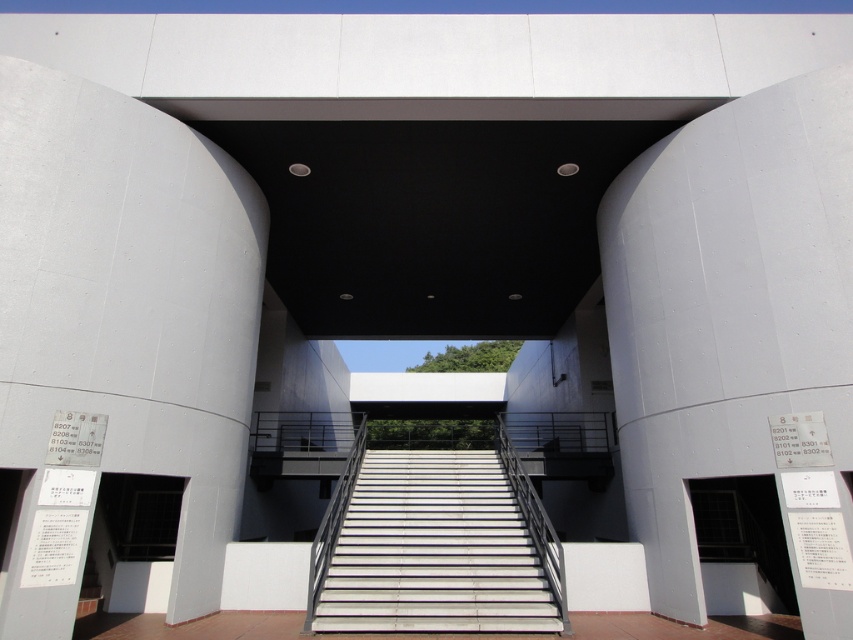
Question: Does white concrete stairs at center appear over white matte door at lower right?

Choices:
 (A) no
 (B) yes

Answer: (B)

Question: Which object is closer to the camera taking this photo?

Choices:
 (A) smooth concrete pillar at center
 (B) white matte door at lower right
 (C) smooth concrete pillar at left

Answer: (C)

Question: Considering the real-world distances, which object is farthest from the smooth concrete pillar at center?

Choices:
 (A) white matte door at lower right
 (B) white concrete stairs at center
 (C) smooth concrete pillar at left

Answer: (C)

Question: In this image, where is smooth concrete pillar at center located relative to white concrete stairs at center?

Choices:
 (A) below
 (B) above

Answer: (B)

Question: Among these points, which one is nearest to the camera?

Choices:
 (A) (737, 529)
 (B) (662, 518)
 (C) (352, 516)
 (D) (28, 486)

Answer: (D)

Question: Is smooth concrete pillar at left further to camera compared to smooth concrete pillar at center?

Choices:
 (A) yes
 (B) no

Answer: (B)